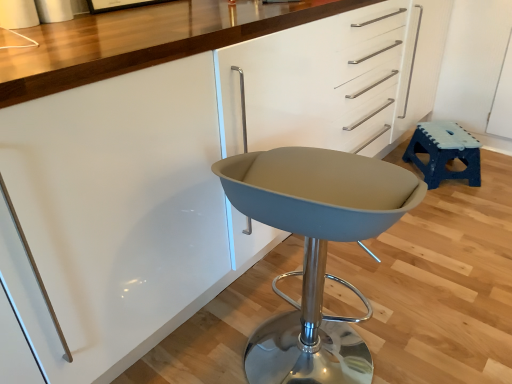
Question: Is matte gray swivel chair at center surrounding blue plastic stool at right?

Choices:
 (A) yes
 (B) no

Answer: (B)

Question: From the image's perspective, is matte gray swivel chair at center below blue plastic stool at right?

Choices:
 (A) yes
 (B) no

Answer: (A)

Question: Does matte gray swivel chair at center lie in front of blue plastic stool at right?

Choices:
 (A) yes
 (B) no

Answer: (A)

Question: From the image's perspective, does matte gray swivel chair at center appear higher than blue plastic stool at right?

Choices:
 (A) yes
 (B) no

Answer: (B)

Question: Considering the relative sizes of matte gray swivel chair at center and blue plastic stool at right in the image provided, is matte gray swivel chair at center taller than blue plastic stool at right?

Choices:
 (A) yes
 (B) no

Answer: (A)

Question: From a real-world perspective, is matte gray swivel chair at center on top of blue plastic stool at right?

Choices:
 (A) no
 (B) yes

Answer: (B)

Question: Is the position of blue plastic stool at right less distant than that of matte gray swivel chair at center?

Choices:
 (A) yes
 (B) no

Answer: (B)

Question: From the image's perspective, is blue plastic stool at right located beneath matte gray swivel chair at center?

Choices:
 (A) yes
 (B) no

Answer: (B)

Question: Considering the relative positions of blue plastic stool at right and matte gray swivel chair at center in the image provided, is blue plastic stool at right to the left of matte gray swivel chair at center from the viewer's perspective?

Choices:
 (A) yes
 (B) no

Answer: (B)

Question: Is blue plastic stool at right at the right side of matte gray swivel chair at center?

Choices:
 (A) no
 (B) yes

Answer: (B)

Question: Is blue plastic stool at right facing towards matte gray swivel chair at center?

Choices:
 (A) no
 (B) yes

Answer: (A)

Question: From the image's perspective, is blue plastic stool at right above matte gray swivel chair at center?

Choices:
 (A) yes
 (B) no

Answer: (A)

Question: Considering their positions, is blue plastic stool at right located in front of or behind matte gray swivel chair at center?

Choices:
 (A) front
 (B) behind

Answer: (B)